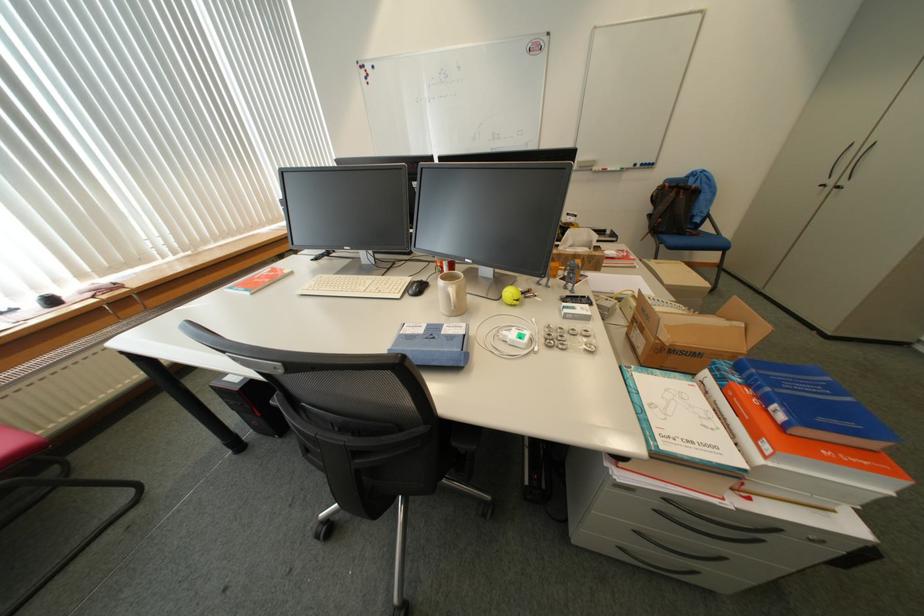
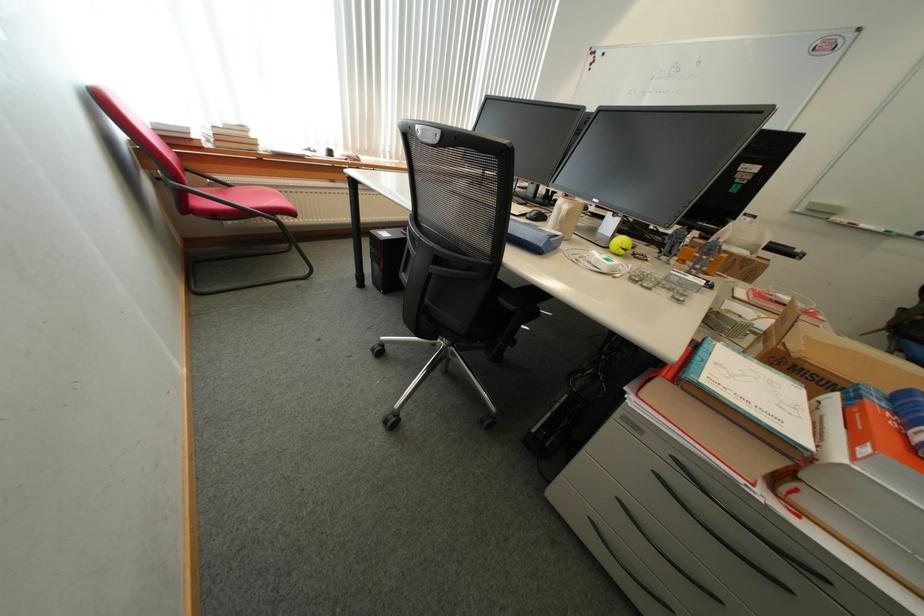
Where in the second image is the point corresponding to pixel 614 171 from the first image?

(861, 225)